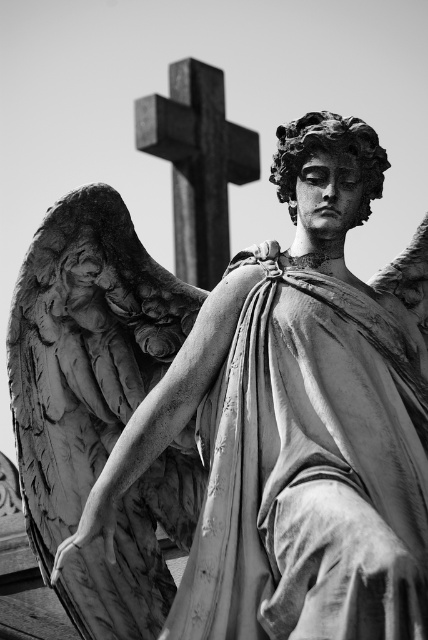
Question: Is smooth stone angel at center to the left of smooth stone cross at upper center from the viewer's perspective?

Choices:
 (A) no
 (B) yes

Answer: (A)

Question: Which object appears farthest from the camera in this image?

Choices:
 (A) smooth stone cross at upper center
 (B) smooth stone angel wings at left

Answer: (A)

Question: Can you confirm if smooth stone angel at center is smaller than smooth stone cross at upper center?

Choices:
 (A) yes
 (B) no

Answer: (B)

Question: Is smooth stone angel wings at left positioned behind smooth stone cross at upper center?

Choices:
 (A) yes
 (B) no

Answer: (B)

Question: Estimate the real-world distances between objects in this image. Which object is closer to the smooth stone angel at center?

Choices:
 (A) smooth stone cross at upper center
 (B) smooth stone angel wings at left

Answer: (B)

Question: Which is farther from the smooth stone angel at center?

Choices:
 (A) smooth stone cross at upper center
 (B) smooth stone angel wings at left

Answer: (A)